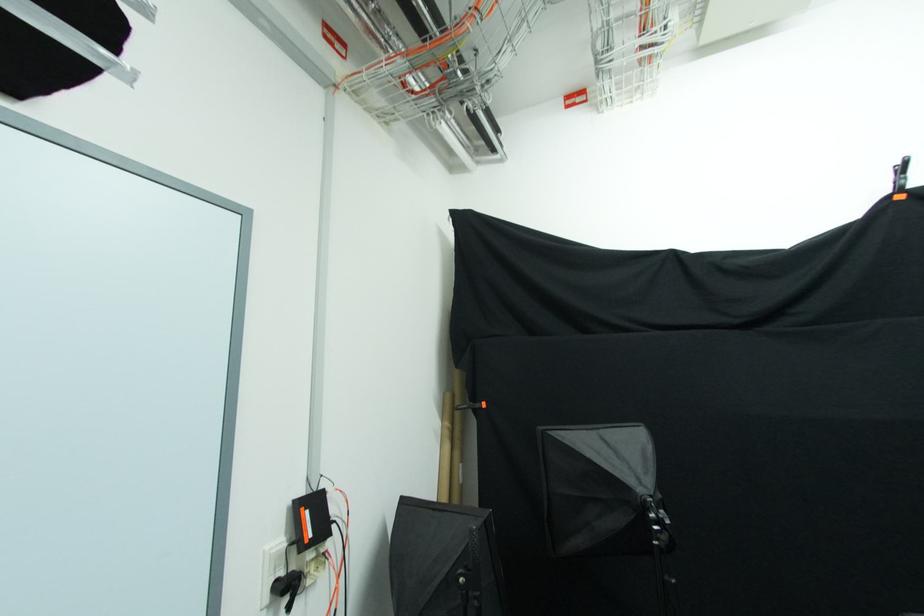
The image size is (924, 616). I want to click on backdrop stand clip, so coord(900,177).